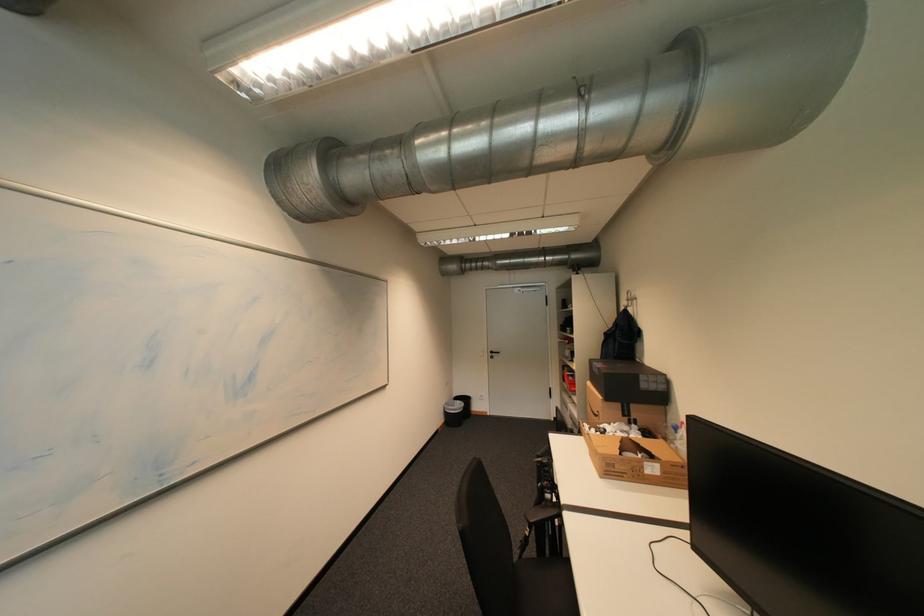
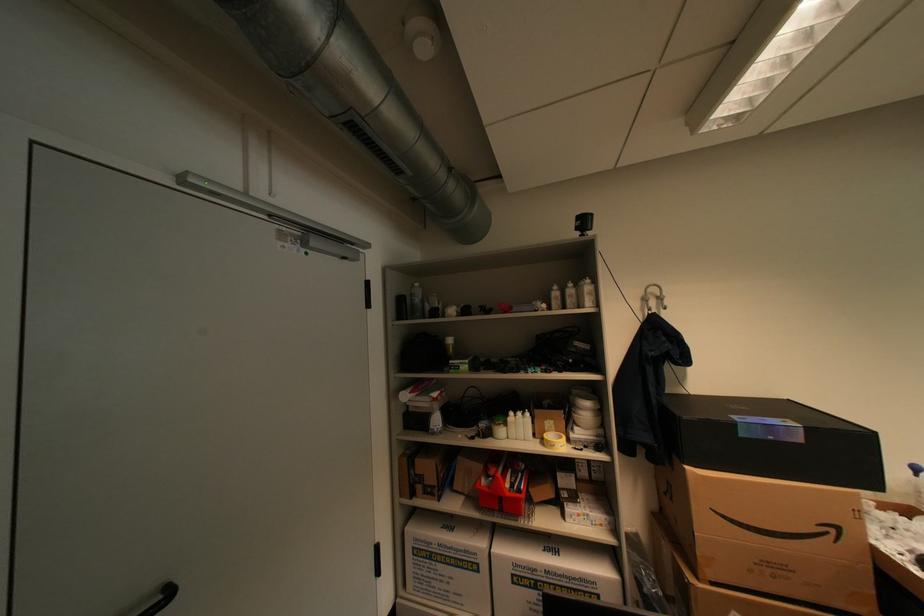
Where in the second image is the point corresponding to the point at 606,374 from the first image?

(808, 440)